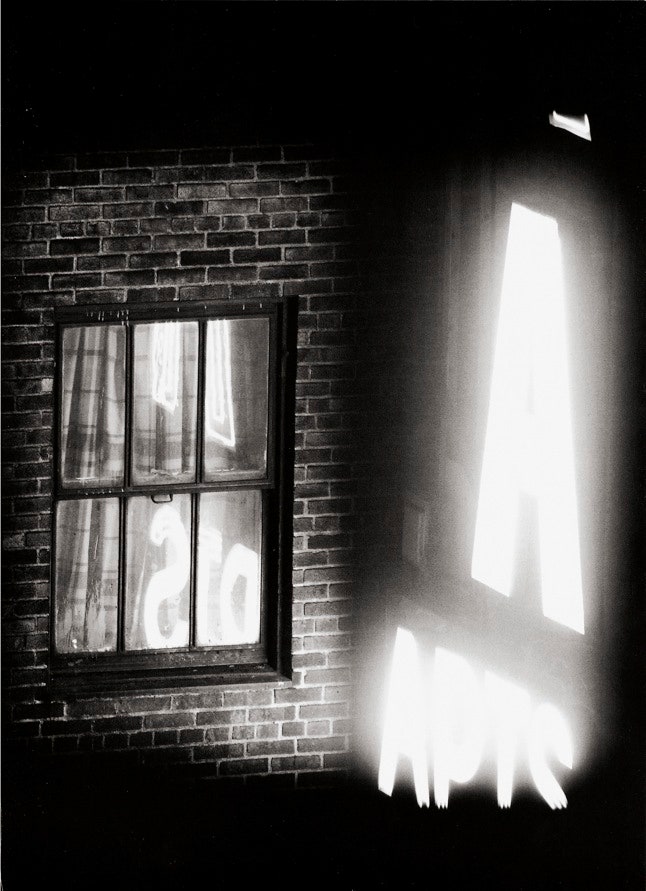
At what (x,y) coordinates should I click in order to perform the action: click on light. Please return your answer as a coordinate pair (x, y). This screenshot has height=891, width=646. Looking at the image, I should click on point(584,136).